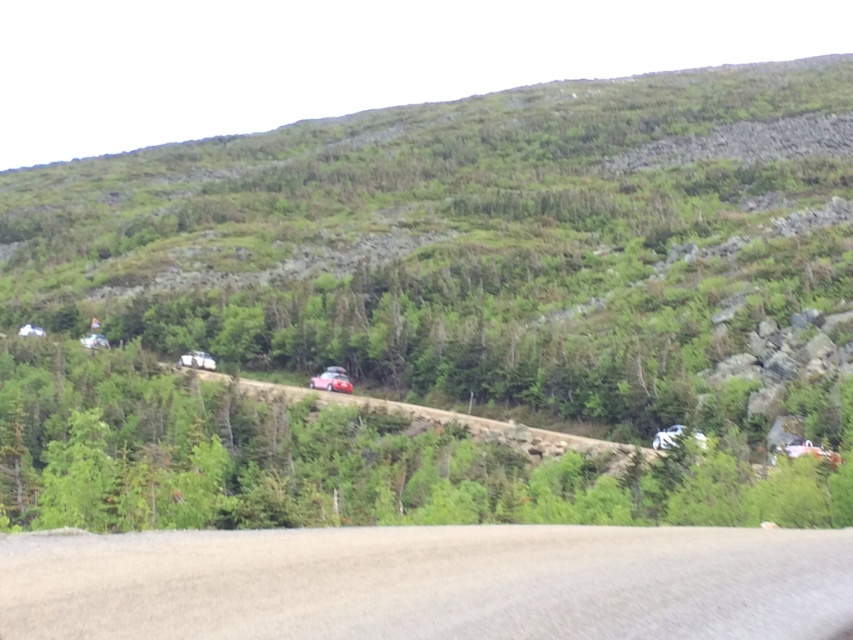
You are a pedestrian standing on the paved road and want to walk to the green matte tree at center. Which direction should you walk relative to the metallic silver car at center?

The green matte tree at center is positioned on the left side of the metallic silver car at center, so you should walk to the left of the metallic silver car at center to reach it.

You are a hiker planning to walk from the green matte tree at center to the brown gravel road at lower center. Which direction should you head to reach the road?

The green matte tree at center is positioned under the brown gravel road at lower center, so you should head upward to reach the road.

You are a hiker standing on the green matte tree at center and want to reach the brown gravel road at lower center. Which direction should you move to get there?

The green matte tree at center is further to the viewer than the brown gravel road at lower center, so you should move forward towards the road.